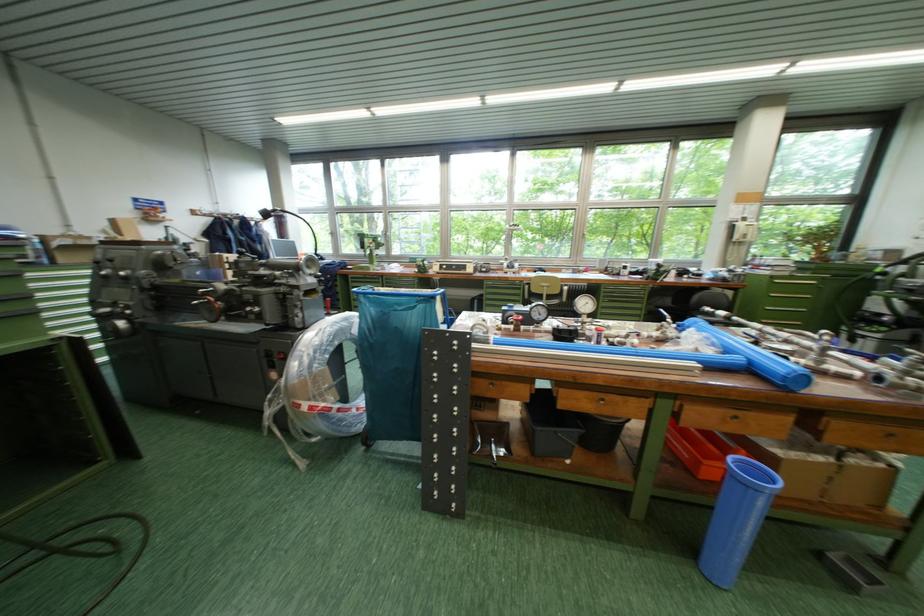
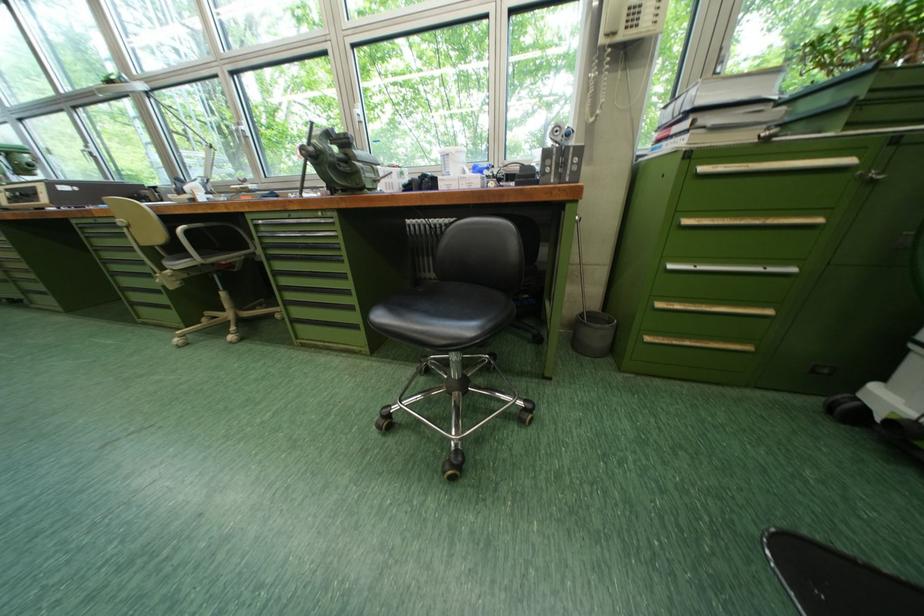
In the second image, find the point that corresponds to point (786, 284) in the first image.

(713, 169)